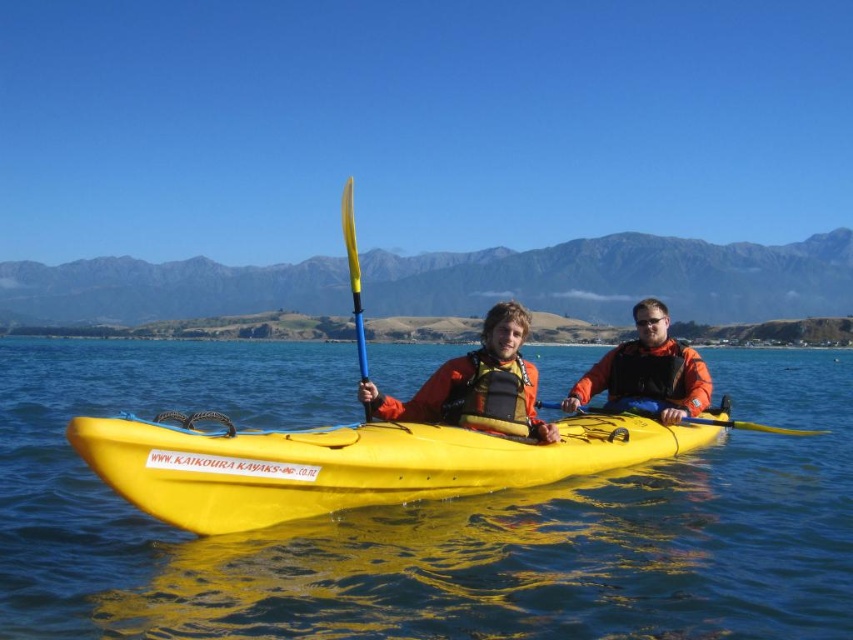
You are a safety inspector checking the kayaking equipment. You notice the orange fabric life jacket at center and the yellow plastic paddle at center. According to safety regulations, the life jacket must be worn above the paddle at all times. Is the current arrangement compliant?

The orange fabric life jacket at center is below the yellow plastic paddle at center, which violates the safety regulation requirement that the life jacket must be worn above the paddle. Therefore, the current arrangement is not compliant.

What is the exact coordinate of the yellow plastic canoe at center?

The yellow plastic canoe at center is located at point (347, 464).

You are a photographer trying to capture a closeup shot of the orange fabric life jacket at center and the yellow plastic paddle at center. Which object should you zoom in on to ensure both are in focus without changing your position?

The orange fabric life jacket at center is smaller than the yellow plastic paddle at center, so you should zoom in on the orange fabric life jacket at center to ensure both are in focus without changing your position.